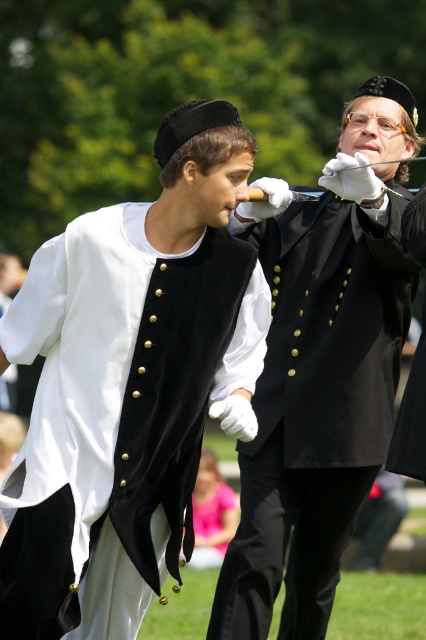
You are a tailor observing two black velvet vests in the image. The first is labeled as the velvet black vest at center, and the second as the black velvet vest at center. According to the description, which one is positioned to the left?

The velvet black vest at center is positioned to the left of the black velvet vest at center.

You are an event photographer at the ceremony. You notice two black velvet vests in the image. Which one is closer to you, the velvet black vest at center or the black velvet vest at center?

The velvet black vest at center is closer to you because it is in front of the black velvet vest at center.